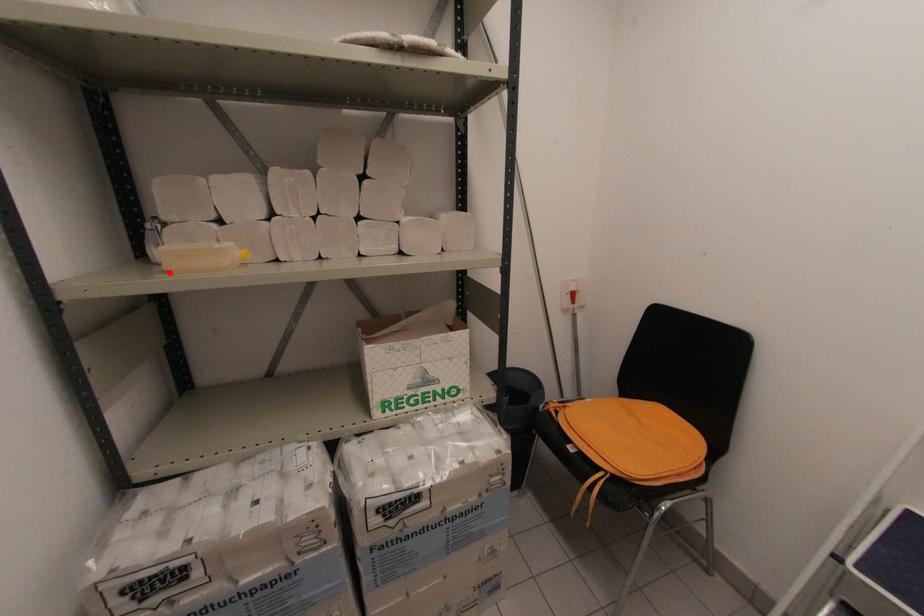
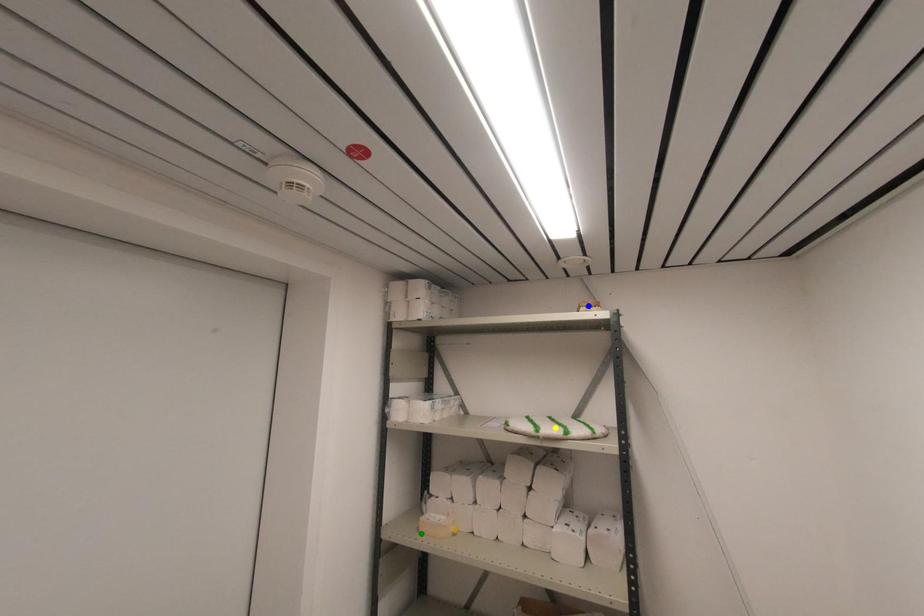
Question: I am providing you with two images of the same scene from different viewpoints. A red point is marked on the first image. You are given multiple points on the second image. In image 2, which mark is for the same physical point as the one in image 1?

Choices:
 (A) yellow point
 (B) green point
 (C) blue point

Answer: (B)